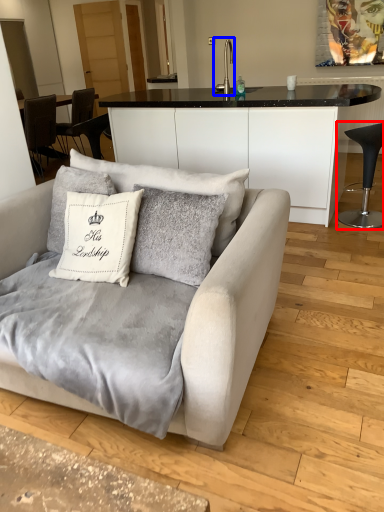
Question: Which object appears farthest to the camera in this image, chair (highlighted by a red box) or silver (highlighted by a blue box)?

Choices:
 (A) chair
 (B) silver

Answer: (B)